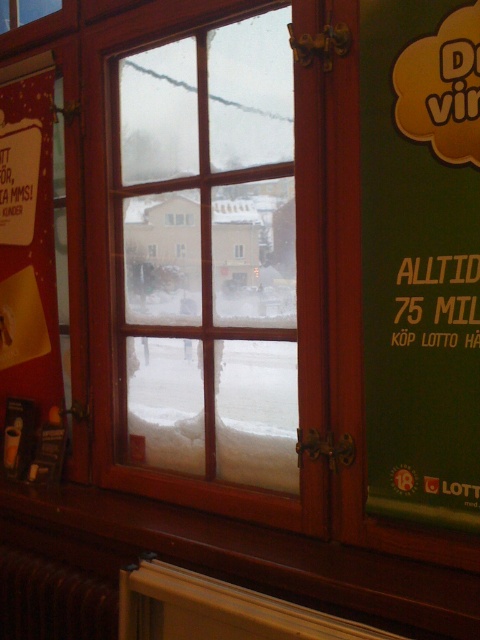
Between wooden window at center and matte red poster at left, which one is positioned lower?

matte red poster at left is below.

Does wooden window at center have a lesser height compared to matte red poster at left?

In fact, wooden window at center may be taller than matte red poster at left.

Between point (288, 131) and point (27, 333), which one is positioned in front?

Positioned in front is point (288, 131).

You are a GUI agent. You are given a task and a screenshot of the screen. Output one action in this format:
    pyautogui.click(x=<x>, y=<y>)
    Task: Click on the wooden window at center
    This screenshot has width=480, height=640.
    Given the screenshot: What is the action you would take?
    pyautogui.click(x=207, y=260)

Is point (2, 93) positioned after point (43, 582)?

Yes, point (2, 93) is farther from viewer.

The height and width of the screenshot is (640, 480). Identify the location of matte red poster at left. (28, 280).

Which is in front, point (45, 344) or point (73, 621)?

Point (73, 621) is more forward.

You are a GUI agent. You are given a task and a screenshot of the screen. Output one action in this format:
    pyautogui.click(x=<x>, y=<y>)
    Task: Click on the matte red poster at left
    The width and height of the screenshot is (480, 640).
    Given the screenshot: What is the action you would take?
    pyautogui.click(x=28, y=280)

Which of these two, wooden window at center or brown metallic radiator at lower left, stands taller?

wooden window at center

The width and height of the screenshot is (480, 640). Describe the element at coordinates (207, 260) in the screenshot. I see `wooden window at center` at that location.

Where is `wooden window at center`? Image resolution: width=480 pixels, height=640 pixels. wooden window at center is located at coordinates (207, 260).